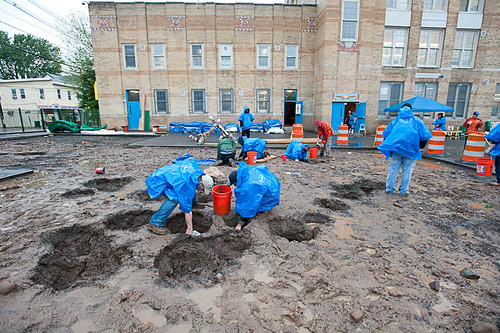
The image size is (500, 333). Identify the location of doors. (138, 108), (301, 114), (340, 107), (362, 107).